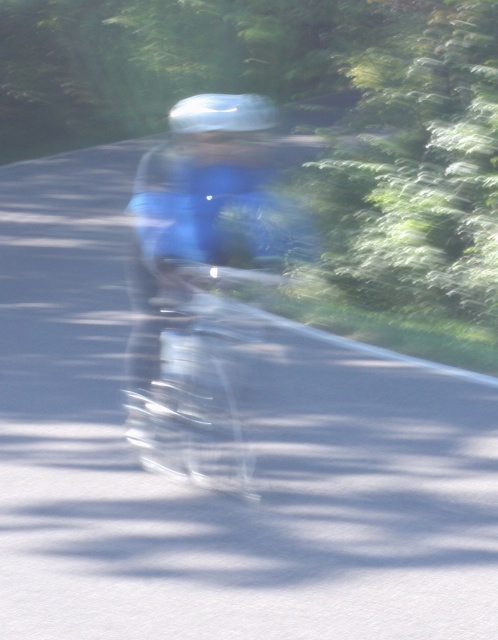
You are a photographer trying to capture the cyclist in the image. You notice the clear plastic bicycle at center and the shiny silver helmet at center. Which object appears smaller in the photo?

The clear plastic bicycle at center appears smaller than the shiny silver helmet at center in the photo.

You are a delivery person who needs to attach a GPS tracker to either the clear plastic bicycle at center or the shiny silver helmet at center. The GPS tracker requires a minimum of 10 feet of space between the device and any other metal objects to function properly. Based on the scene, can the GPS tracker be placed on either object without interfering with its functionality?

The distance between the clear plastic bicycle at center and the shiny silver helmet at center is 8.42 feet. Since the required minimum distance is 10 feet, placing the GPS tracker on either object would result in interference because the distance between them is less than the required 10 feet.